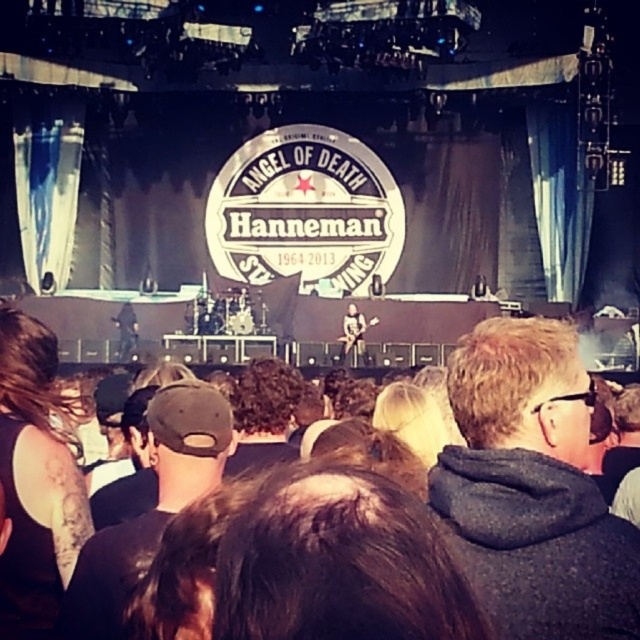
Question: Among these objects, which one is farthest from the camera?

Choices:
 (A) dark brown hair at lower left
 (B) dark gray hoodie at center

Answer: (A)

Question: Does dark brown hair at lower left have a smaller size compared to black fabric cap at center?

Choices:
 (A) no
 (B) yes

Answer: (A)

Question: Estimate the real-world distances between objects in this image. Which object is farther from the black fabric cap at center?

Choices:
 (A) dark gray hoodie at center
 (B) dark brown hair at lower left

Answer: (A)

Question: Does dark brown hair at lower left have a lesser width compared to black fabric cap at center?

Choices:
 (A) yes
 (B) no

Answer: (A)

Question: Can you confirm if dark gray hoodie at center is bigger than dark brown hair at lower left?

Choices:
 (A) no
 (B) yes

Answer: (B)

Question: Estimate the real-world distances between objects in this image. Which object is farther from the black fabric cap at center?

Choices:
 (A) dark gray hoodie at center
 (B) dark brown hair at lower left

Answer: (A)